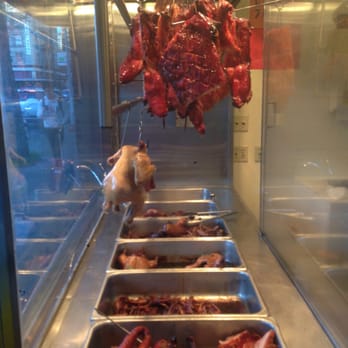
Locate an element on the screen. This screenshot has height=348, width=348. right side reflections of metallic buffet trays is located at coordinates (270, 198), (286, 217), (300, 237), (326, 270).